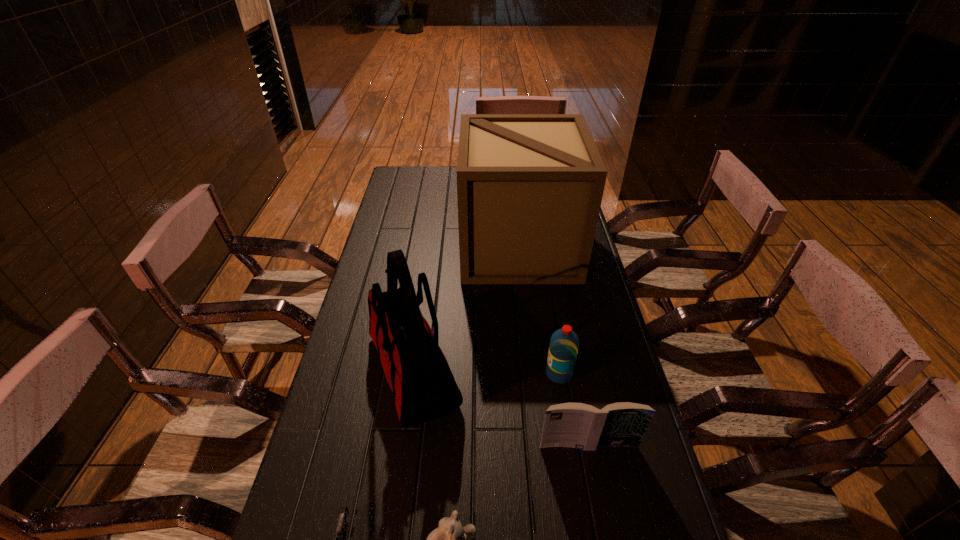
Image resolution: width=960 pixels, height=540 pixels. In order to click on vacant space located 0.370m on the front label of the water bottle in this screenshot , I will do (x=411, y=374).

This screenshot has height=540, width=960. Find the location of `free space located on the front cover of the fourth farthest object`. free space located on the front cover of the fourth farthest object is located at coordinates pos(601,509).

This screenshot has height=540, width=960. What are the coordinates of `object at the left edge` in the screenshot? It's located at (418, 373).

Where is `box at the right edge`? box at the right edge is located at coordinates (529, 186).

Find the location of `water bottle that is at the right edge`. water bottle that is at the right edge is located at coordinates (564, 343).

You are a GUI agent. You are given a task and a screenshot of the screen. Output one action in this format:
    pyautogui.click(x=<x>, y=<y>)
    Task: Click on the book located in the right edge section of the desktop
    This screenshot has width=960, height=540.
    Given the screenshot: What is the action you would take?
    pyautogui.click(x=577, y=425)

In the image, there is a desktop. Identify the location of vacant space at the far edge. Image resolution: width=960 pixels, height=540 pixels. (438, 175).

This screenshot has width=960, height=540. Identify the location of vacant space at the left edge of the desktop. (310, 469).

In the image, there is a desktop. Where is `vacant area at the right edge`? The height and width of the screenshot is (540, 960). vacant area at the right edge is located at coordinates click(x=596, y=367).

In the image, there is a desktop. In order to click on free space at the far left corner in this screenshot , I will do `click(403, 188)`.